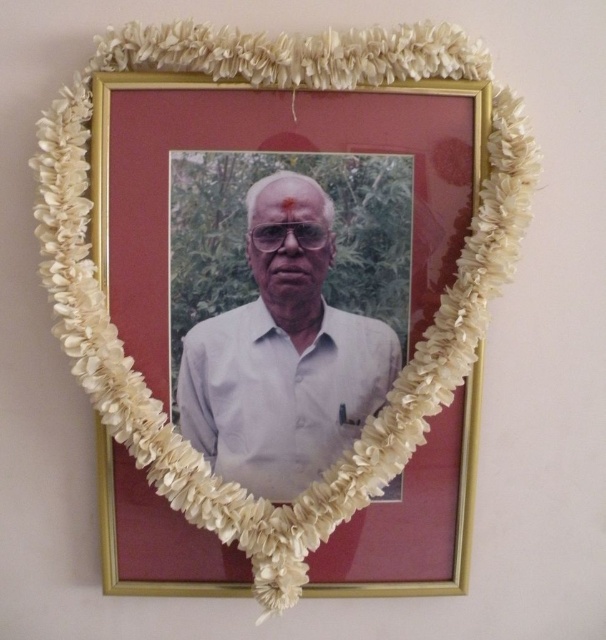
You are an art curator examining the framed photograph. You notice two points marked on the frame. The first point is at coordinates point (119,116) and the second is at point (235,472). Which of these points is closer to the viewer?

Point (119,116) is in front of point (235,472), so it is closer to the viewer.

You are an art conservator examining the framed photograph. You notice the gold metallic picture frame at center and the white matte shirt at center. Which object is positioned nearer to your line of sight?

The gold metallic picture frame at center is closer to the viewer than the white matte shirt at center, so the gold metallic picture frame at center is nearer to your line of sight.

You are an interior designer planning to hang a new painting in a room. You have a wall space that can accommodate items up to 0.4 meters wide. The gold metallic picture frame at center currently occupies a position at point 0.395 on the wall. Is there enough space to hang another item next to it without overlapping?

The gold metallic picture frame at center is positioned at 0.395 on the wall. Since the available space allows up to 0.4 meters, there is insufficient space to place another item next to it without overlapping.